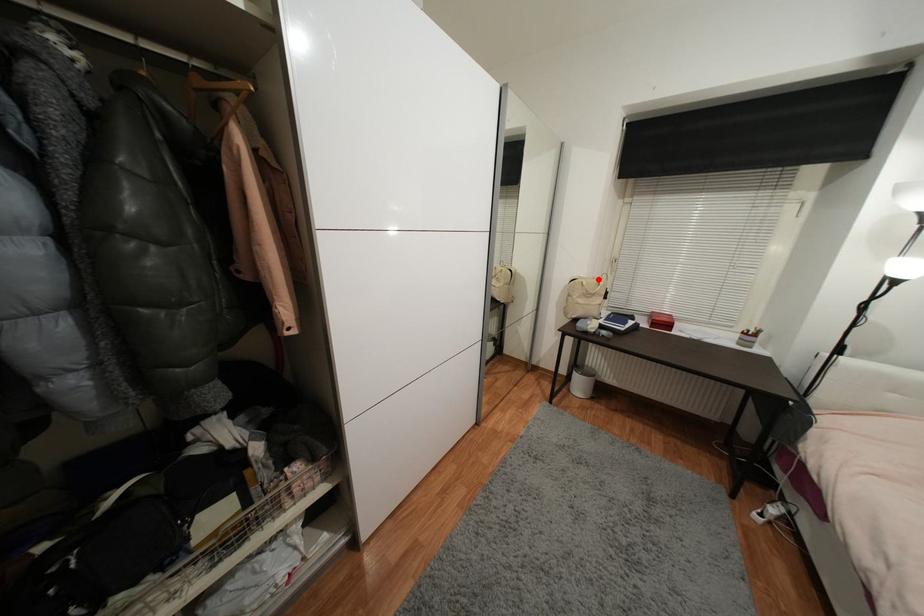
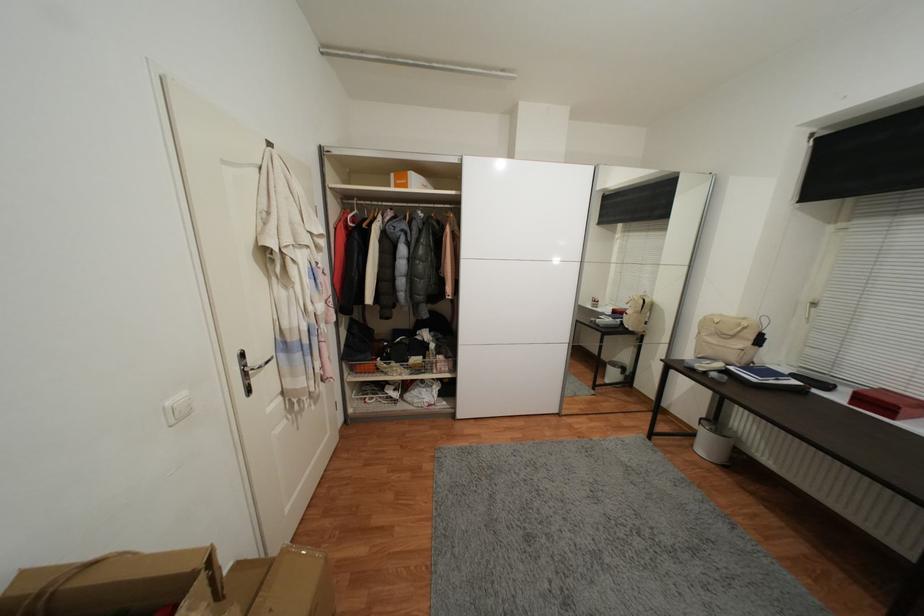
Find the pixel in the second image that matches the highlighted location in the first image.

(748, 321)